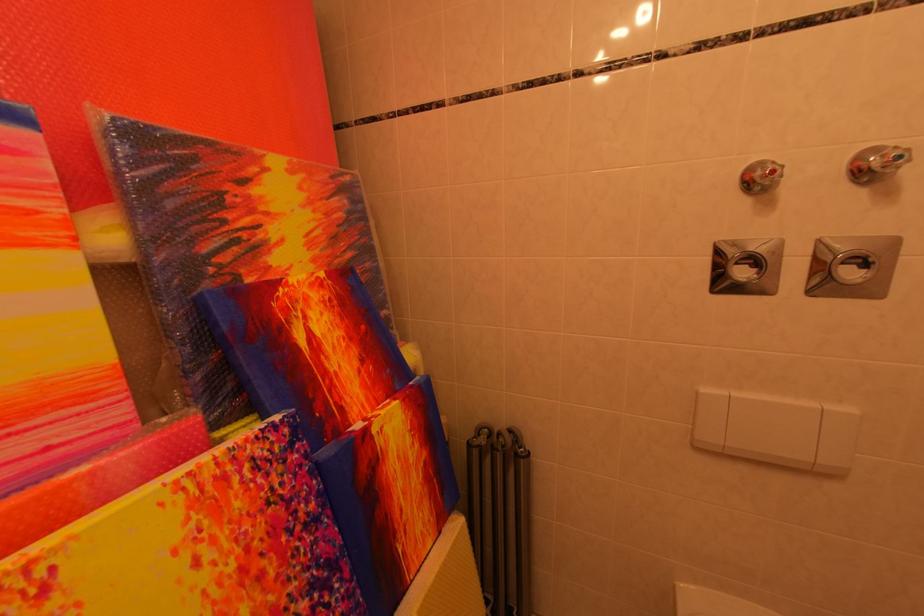
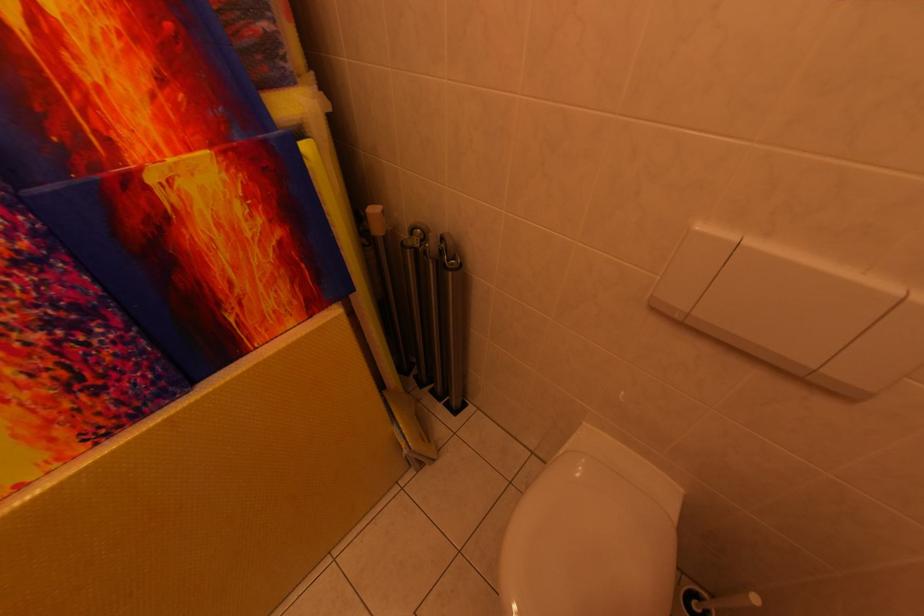
Question: How did the camera likely rotate?

Choices:
 (A) Left
 (B) Right
 (C) Up
 (D) Down

Answer: (D)